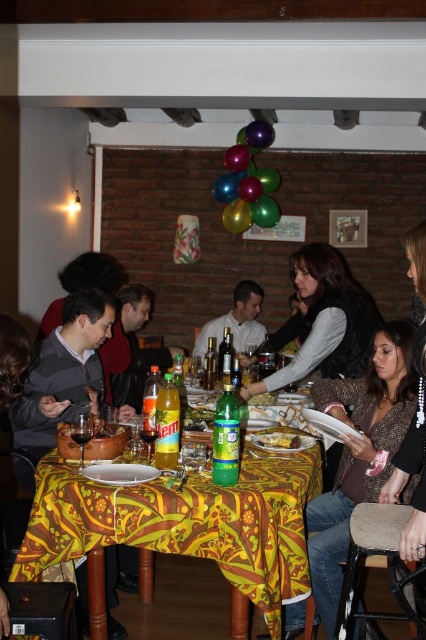
What do you see at coordinates (325, 321) in the screenshot? I see `matte gray sweater at center` at bounding box center [325, 321].

Does matte gray sweater at center appear under metallic balloons at center?

Yes, matte gray sweater at center is below metallic balloons at center.

Is point (336, 371) closer to camera compared to point (229, 154)?

That is True.

What are the coordinates of `matte gray sweater at center` in the screenshot? It's located at (325, 321).

Based on the photo, is the position of metallic balloons at center more distant than that of metallic green balloon at upper center?

No, it is not.

Image resolution: width=426 pixels, height=640 pixels. I want to click on metallic balloons at center, so click(247, 180).

Image resolution: width=426 pixels, height=640 pixels. Describe the element at coordinates (247, 180) in the screenshot. I see `metallic balloons at center` at that location.

Image resolution: width=426 pixels, height=640 pixels. Identify the location of metallic balloons at center. (247, 180).

Consider the image. Can you confirm if brown textured blazer at lower right is bigger than matte gray sweater at left?

Correct, brown textured blazer at lower right is larger in size than matte gray sweater at left.

Is brown textured blazer at lower right to the right of matte gray sweater at left from the viewer's perspective?

Yes, brown textured blazer at lower right is to the right of matte gray sweater at left.

Locate an element on the screen. This screenshot has width=426, height=640. brown textured blazer at lower right is located at coordinates (359, 452).

Where is `brown textured blazer at lower right`? brown textured blazer at lower right is located at coordinates (359, 452).